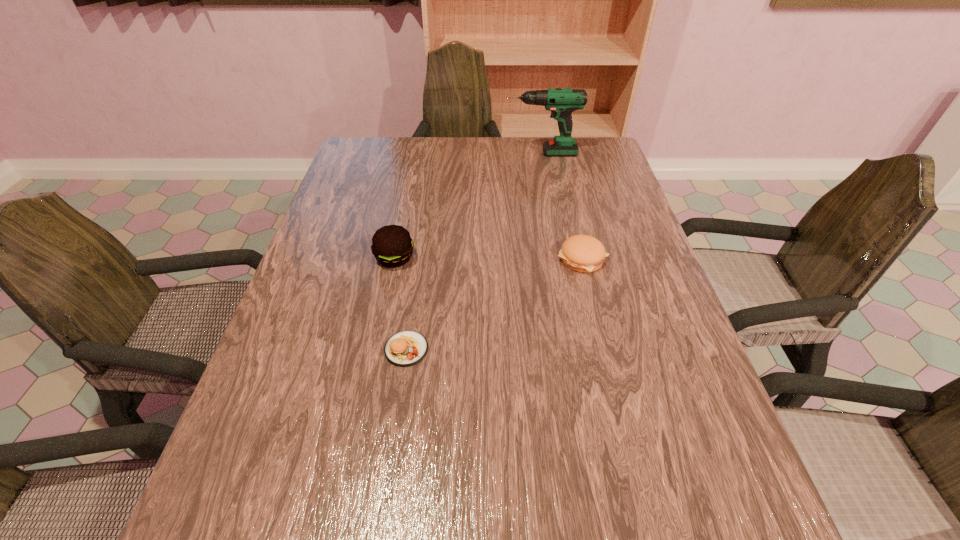
Where is `the tallest object`? The image size is (960, 540). the tallest object is located at coordinates (561, 102).

Find the location of a particular element. This screenshot has width=960, height=540. the farthest object is located at coordinates (561, 102).

The width and height of the screenshot is (960, 540). I want to click on the tallest patty, so click(392, 246).

Find the location of a particular element. the rightmost patty is located at coordinates pyautogui.click(x=583, y=253).

You are a GUI agent. You are given a task and a screenshot of the screen. Output one action in this format:
    pyautogui.click(x=<x>, y=<y>)
    Task: Click on the shortest object
    The image size is (960, 540).
    Given the screenshot: What is the action you would take?
    pyautogui.click(x=406, y=348)

Where is `the nearest patty`? This screenshot has width=960, height=540. the nearest patty is located at coordinates (406, 348).

Find the location of a particular element. This screenshot has width=960, height=540. free space located on the handle side of the tallest object is located at coordinates (384, 153).

Identify the location of free space located on the handle side of the tallest object. Image resolution: width=960 pixels, height=540 pixels. (484, 153).

At what (x,y) coordinates should I click in order to perform the action: click on vacant area located on the handle side of the tallest object. Please return your answer as a coordinate pair (x, y). The image size is (960, 540). Looking at the image, I should click on (444, 153).

This screenshot has height=540, width=960. I want to click on free spot located on the back of the second tallest object, so click(x=412, y=174).